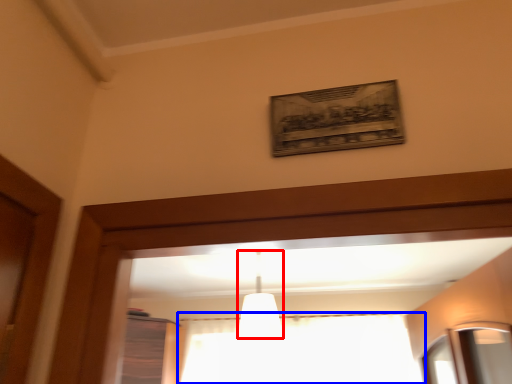
Question: Which point is further to the camera, fixture (highlighted by a red box) or curtain (highlighted by a blue box)?

Choices:
 (A) fixture
 (B) curtain

Answer: (B)